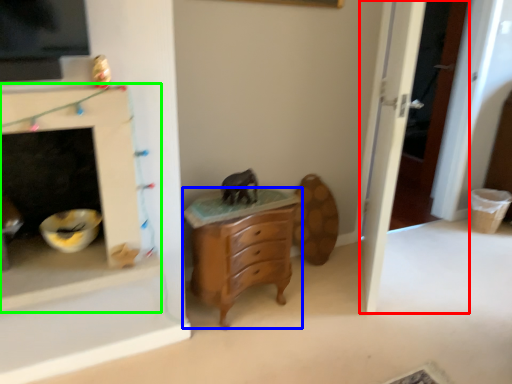
Question: Based on their relative distances, which object is farther from door (highlighted by a red box)? Choose from chest of drawers (highlighted by a blue box) and fireplace (highlighted by a green box).

Choices:
 (A) chest of drawers
 (B) fireplace

Answer: (B)